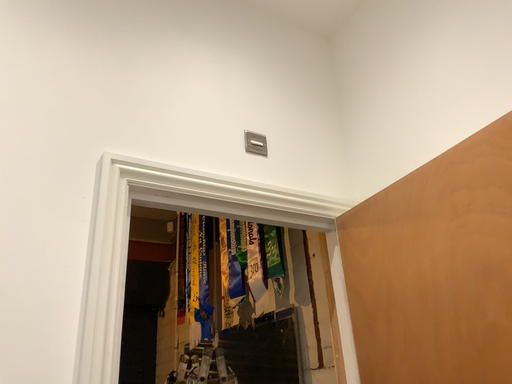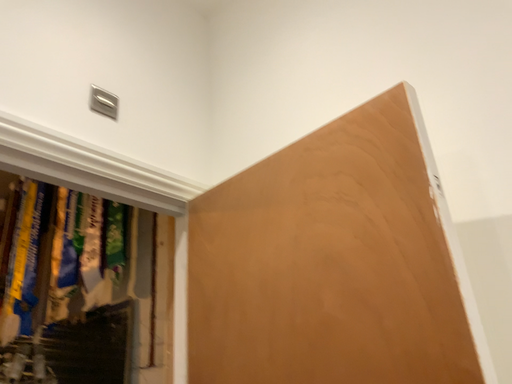
Question: How did the camera likely rotate when shooting the video?

Choices:
 (A) rotated left
 (B) rotated right

Answer: (B)